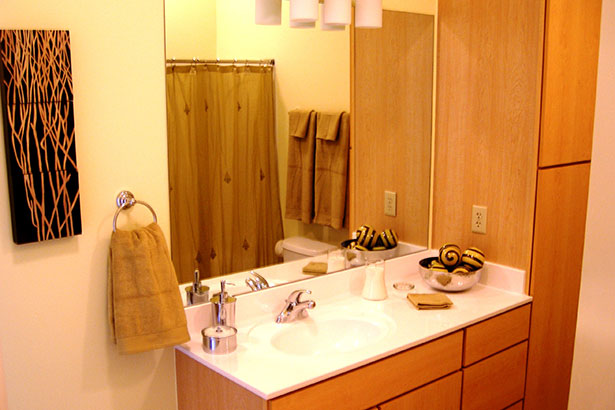
Image resolution: width=615 pixels, height=410 pixels. I want to click on vanity, so click(x=267, y=366), click(x=411, y=330), click(x=497, y=336), click(x=507, y=380), click(x=433, y=394), click(x=401, y=377), click(x=199, y=390), click(x=347, y=314), click(x=327, y=342), click(x=494, y=301).